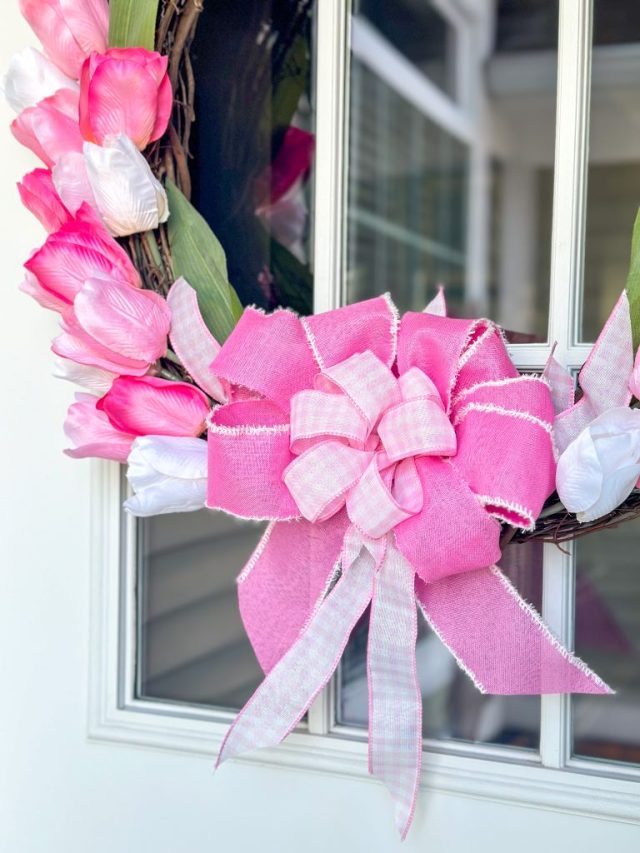
Find the location of `white wall`. white wall is located at coordinates (214, 840).